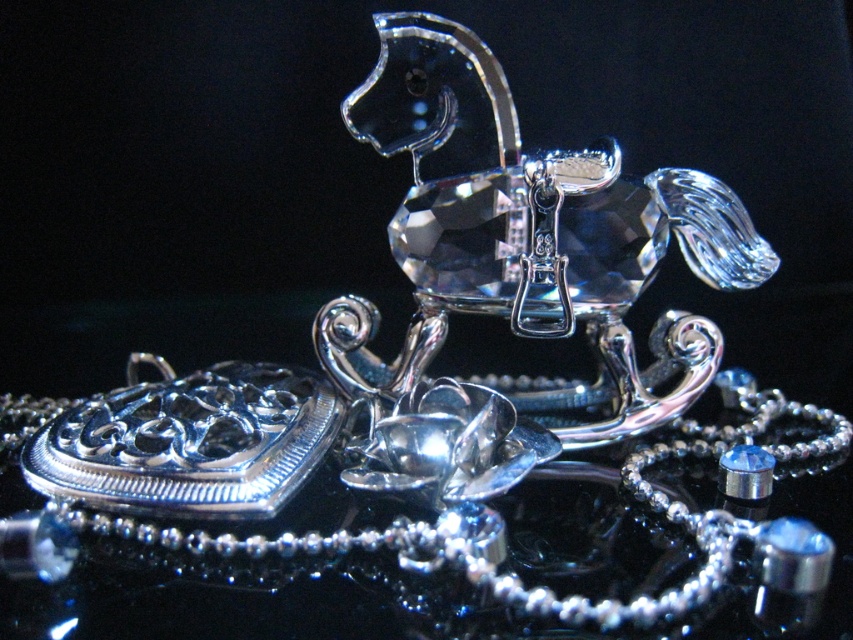
You are an appraiser examining the displayed items. The silver metallic necklace at center and the clear crystal horse at center are both centered in the image. Which object is bigger in size?

The silver metallic necklace at center has a larger size compared to the clear crystal horse at center.

You are an appraiser examining the display case containing the silver metallic necklace at center and the clear crystal horse at center. From the perspective of someone standing directly in front of the case, which object is positioned to the left?

The silver metallic necklace at center is to the left of the clear crystal horse at center.

Where is the silver metallic necklace at center located in the image?

The silver metallic necklace at center is located at point (462, 516) in the image.